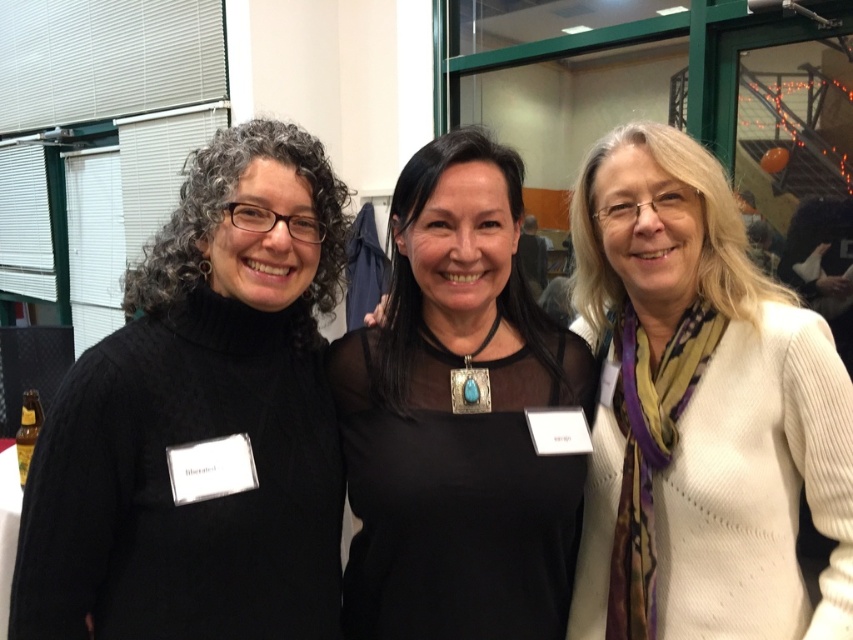
Question: Which point is farther to the camera?

Choices:
 (A) (339, 570)
 (B) (445, 216)

Answer: (A)

Question: Does black sweater at left appear on the right side of white ribbed sweater at center?

Choices:
 (A) no
 (B) yes

Answer: (A)

Question: Where is black sweater at left located in relation to white ribbed sweater at center in the image?

Choices:
 (A) above
 (B) below

Answer: (B)

Question: Which object is positioned closest to the white ribbed sweater at center?

Choices:
 (A) black sweater at left
 (B) black mesh top at center

Answer: (B)

Question: Can you confirm if black sweater at left is thinner than white ribbed sweater at center?

Choices:
 (A) yes
 (B) no

Answer: (B)

Question: Among these objects, which one is farthest from the camera?

Choices:
 (A) black sweater at left
 (B) black mesh top at center

Answer: (B)